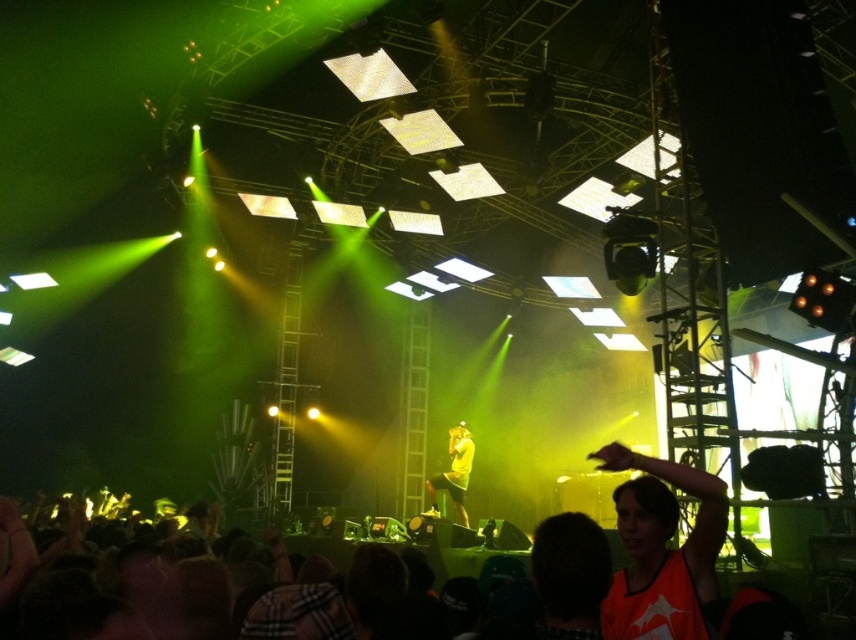
Question: Can you confirm if orange jersey at lower right is bigger than yellow matte shirt at center?

Choices:
 (A) no
 (B) yes

Answer: (A)

Question: Which of the following is the farthest from the observer?

Choices:
 (A) yellow matte shirt at center
 (B) orange jersey at lower right

Answer: (A)

Question: Is orange jersey at lower right closer to camera compared to yellow matte shirt at center?

Choices:
 (A) yes
 (B) no

Answer: (A)

Question: Observing the image, what is the correct spatial positioning of orange jersey at lower right in reference to yellow matte shirt at center?

Choices:
 (A) above
 (B) below

Answer: (A)

Question: Which point is farther from the camera taking this photo?

Choices:
 (A) (468, 456)
 (B) (667, 586)

Answer: (A)

Question: Which of the following is the farthest from the observer?

Choices:
 (A) (642, 500)
 (B) (452, 492)

Answer: (B)